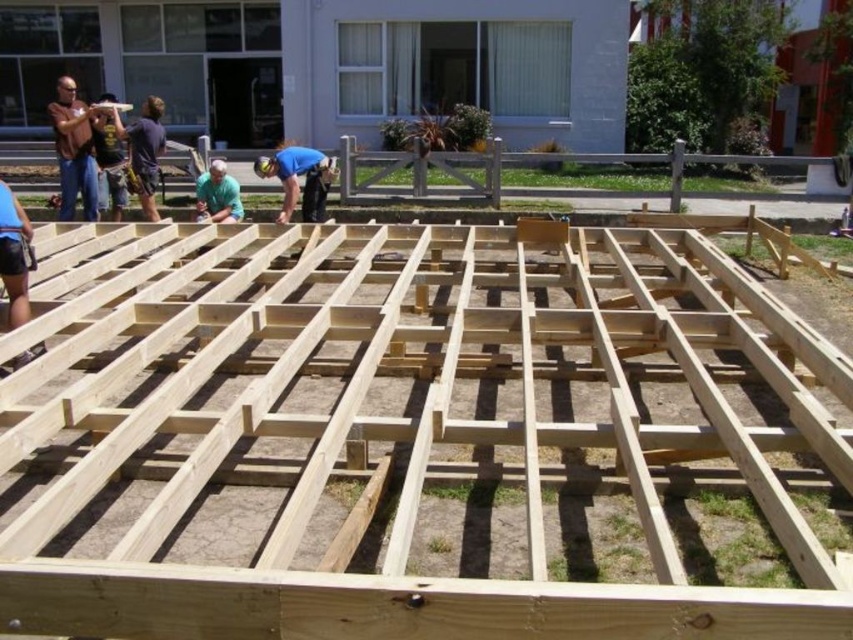
You are observing workers at a construction site. There is a matte brown shirt at left and a light blue shirt at center. Which worker is positioned more to the left side of the scene?

The matte brown shirt at left is positioned more to the left side of the scene than the light blue shirt at center.

You are standing at the construction site looking at the wooden framework. There are two points marked on the framework. The first point is at coordinates point [86,144] and the second is at point [294,156]. If you were to walk from the first point to the second point, would you be moving towards the residential building in the background?

Point [86,144] is in front of point [294,156]. Since moving from the first point to the second point would mean moving away from the residential building, you would not be moving towards it.

You are a construction worker observing two workers at the site. One is wearing a matte brown shirt at left, and the other is wearing a light blue shirt at center. Which worker is wearing a larger shirt?

The matte brown shirt at left is larger in size than the light blue shirt at center, so the worker wearing the matte brown shirt at left has the larger shirt.